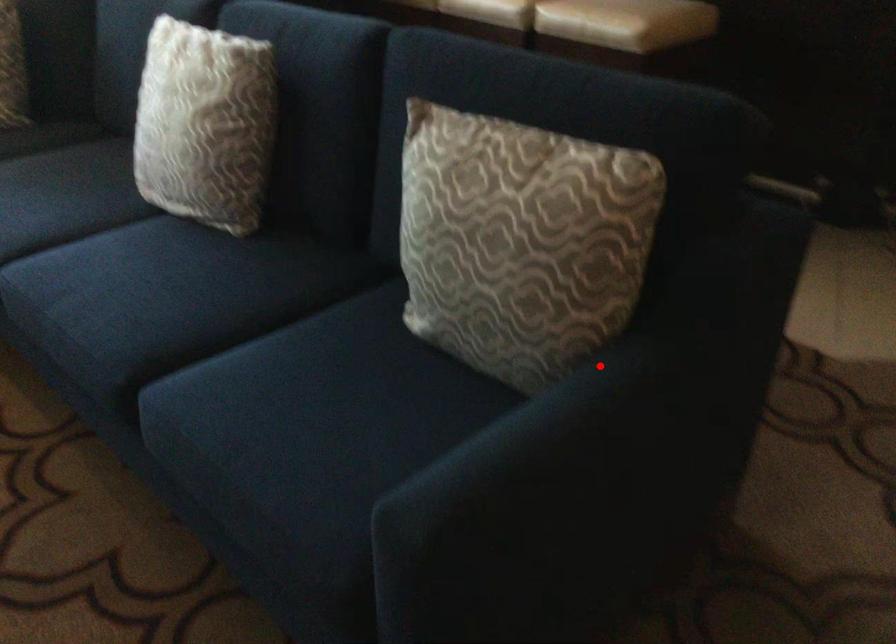
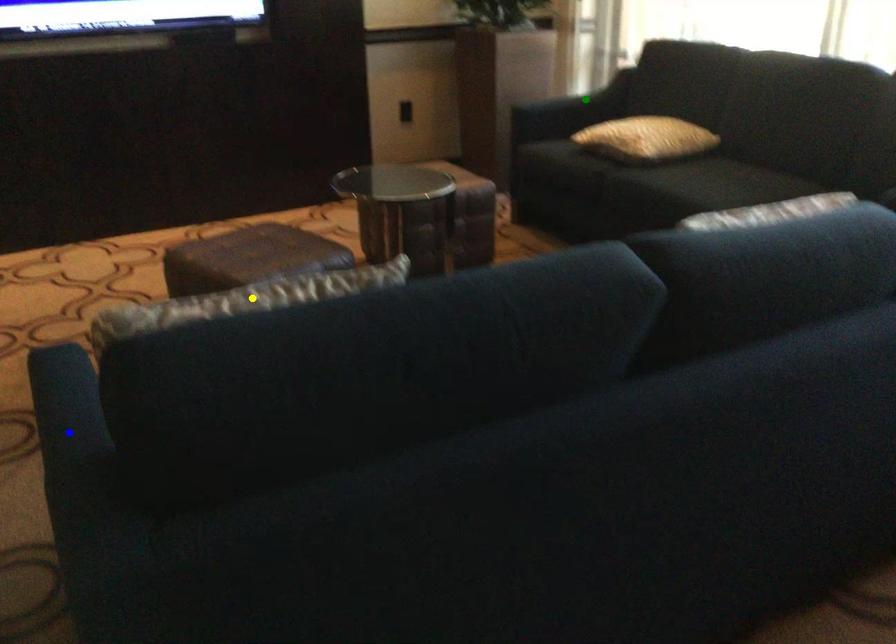
Question: I am providing you with two images of the same scene from different viewpoints. A red point is marked on the first image. You are given multiple points on the second image. Can you choose the point in image 2 that corresponds to the point in image 1?

Choices:
 (A) blue point
 (B) yellow point
 (C) green point

Answer: (A)